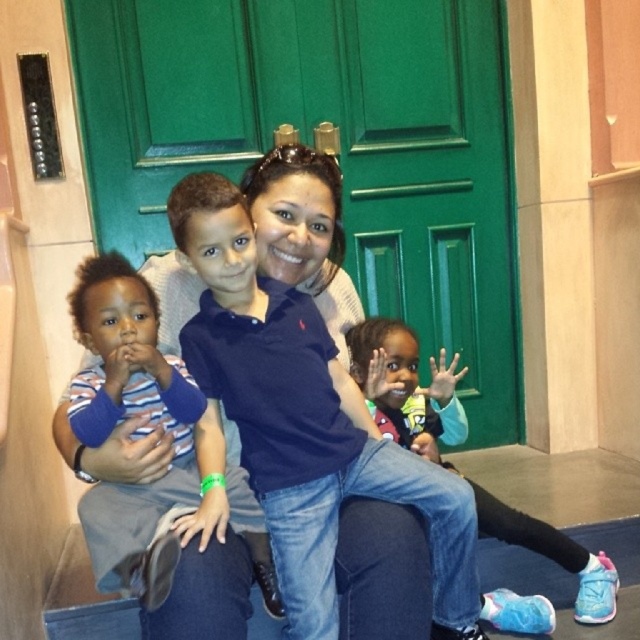
You are a photographer setting up for a family photo. You need to ensure that the striped cotton shirt at left and the blue fabric pants at lower right are visible in the frame. Given their distance apart, will you need to adjust your camera angle to include both?

The striped cotton shirt at left is 27.86 inches away from the blue fabric pants at lower right. Since the distance between them is moderate, you may need to slightly widen your camera angle or step back to ensure both are fully visible in the frame.

You are a photographer standing 1.5 meters away from the camera. You want to take a photo of the blue cotton shirt at center. Can you reach it with your hand to adjust it before taking the photo?

The blue cotton shirt at center is 1.22 meters away from the camera. Since you are standing 1.5 meters away from the camera, the distance between you and the shirt is 1.5 meters plus 1.22 meters, totaling 2.72 meters. This distance is too far to reach with your hand, so you cannot adjust it directly.

You are designing a laundry list for the family. The striped cotton shirt at left and blue fabric pants at lower right need to be washed. Which item requires more detergent because of its size?

The blue fabric pants at lower right require more detergent because they are larger than the striped cotton shirt at left.